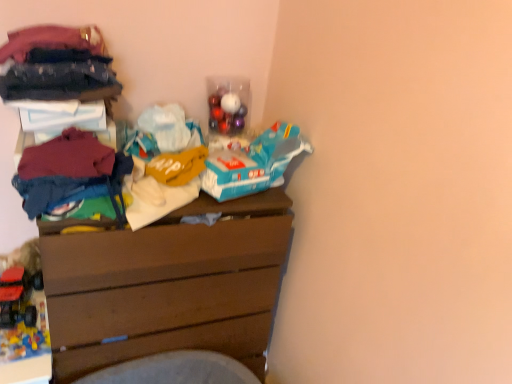
Question: Is point (14, 279) closer or farther from the camera than point (121, 155)?

Choices:
 (A) farther
 (B) closer

Answer: (A)

Question: In terms of width, does rubberized plastic toy truck at lower left, placed as the 2th toy when sorted from bottom to top, look wider or thinner when compared to maroon cotton sweater at left, marked as the third clothing in a top-to-bottom arrangement?

Choices:
 (A) thin
 (B) wide

Answer: (B)

Question: Based on their relative distances, which object is farther from the brown wooden chest of drawers at center?

Choices:
 (A) dark blue fabric at upper left, positioned as the third clothing in bottom-to-top order
 (B) rubberized plastic toy truck at lower left, positioned as the 1th toy in bottom-to-top order
 (C) dark blue fabric at upper left, which is the 2th clothing from top to bottom
 (D) rubberized plastic toy truck at lower left, placed as the 2th toy when sorted from bottom to top
 (E) maroon cotton sweater at left, marked as the third clothing in a top-to-bottom arrangement

Answer: (A)

Question: Based on their relative distances, which object is nearer to the rubberized plastic toy truck at lower left, placed as the 2th toy when sorted from bottom to top?

Choices:
 (A) dark blue fabric at upper left, the 2th clothing from the bottom
 (B) brown wooden chest of drawers at center
 (C) rubberized plastic toy truck at lower left, which ranks as the second toy in top-to-bottom order
 (D) dark blue fabric at upper left, positioned as the third clothing in bottom-to-top order
 (E) maroon cotton sweater at left, marked as the third clothing in a top-to-bottom arrangement

Answer: (C)